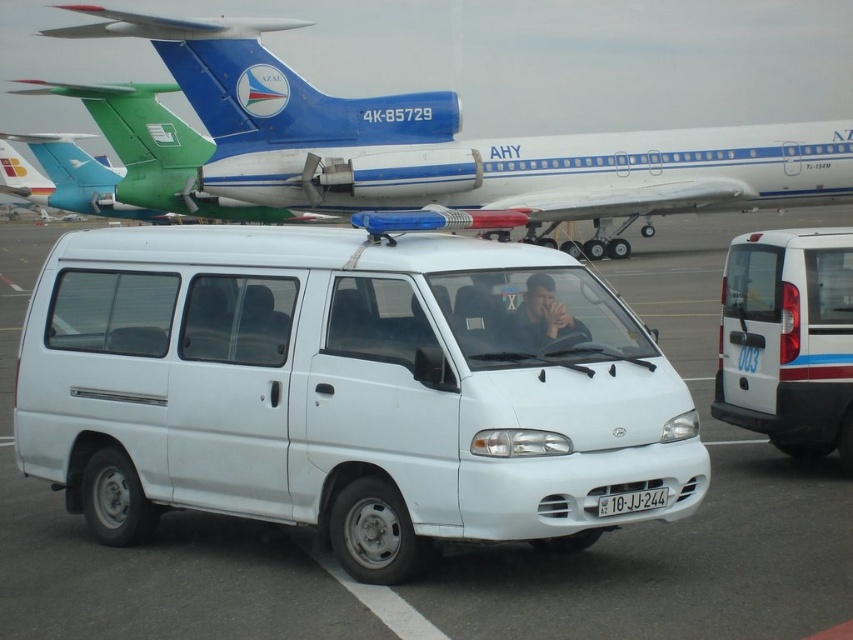
You are a security guard at the airport. You notice the white matte van at right and the matte black shirt at center. Which object is closer to you?

The matte black shirt at center is behind the white matte van at right, so the white matte van at right is closer to you.

You are a security guard at the airport. You see the white matte van at center and the matte black shirt at center. Which object is closer to you?

The white matte van at center is closer to you since it is in front of the matte black shirt at center.